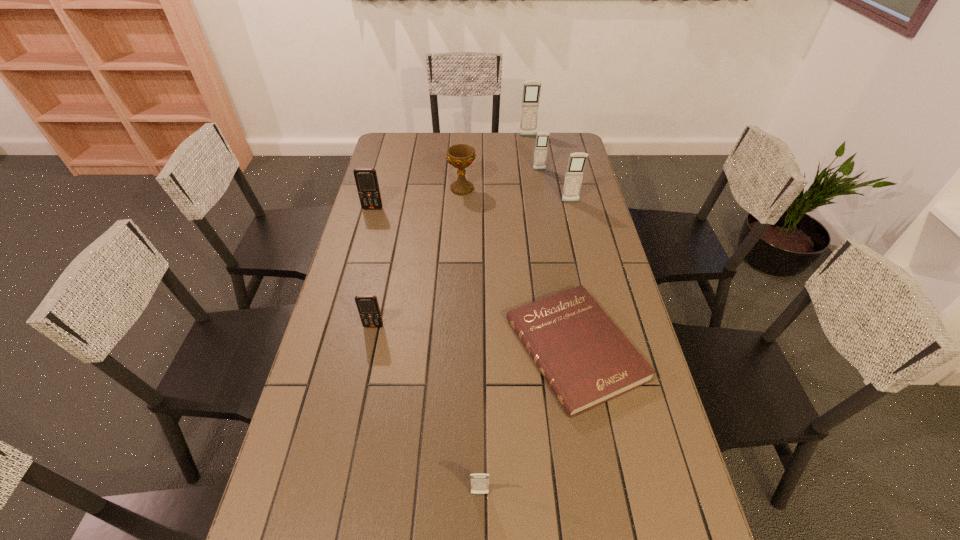
Locate an element on the screen. Image resolution: width=960 pixels, height=540 pixels. unoccupied position between the farthest gray cellular telephone and the nearest gray cellular telephone is located at coordinates tap(504, 315).

At what (x,y) coordinates should I click in order to perform the action: click on free space that is in between the red chalice and the right orange cellular telephone. Please return your answer as a coordinate pair (x, y). Image resolution: width=960 pixels, height=540 pixels. Looking at the image, I should click on (418, 258).

Locate an element on the screen. This screenshot has width=960, height=540. vacant area that lies between the shortest object and the second tallest object is located at coordinates (572, 275).

The width and height of the screenshot is (960, 540). Identify the location of empty space between the tallest cellular telephone and the hardback book. (551, 242).

The height and width of the screenshot is (540, 960). I want to click on vacant region between the red chalice and the second smallest gray cellular telephone, so click(501, 179).

You are a GUI agent. You are given a task and a screenshot of the screen. Output one action in this format:
    pyautogui.click(x=<x>, y=<y>)
    Task: Click on the vacant area that lies between the chalice and the hardback book
    
    Given the screenshot: What is the action you would take?
    pyautogui.click(x=518, y=269)

Identify which object is the fifth closest to the shortest object. Please provide its 2D coordinates. Your answer should be formatted as a tuple, i.e. [(x, y)], where the tuple contains the x and y coordinates of a point satisfying the conditions above.

[(366, 179)]

Locate which object is the sixth closest to the red chalice. Please provide its 2D coordinates. Your answer should be formatted as a tuple, i.e. [(x, y)], where the tuple contains the x and y coordinates of a point satisfying the conditions above.

[(367, 305)]

Point out which cellular telephone is positioned as the third nearest to the farthest cellular telephone. Please provide its 2D coordinates. Your answer should be formatted as a tuple, i.e. [(x, y)], where the tuple contains the x and y coordinates of a point satisfying the conditions above.

[(366, 179)]

Identify which cellular telephone is the fifth closest to the leftmost object. Please provide its 2D coordinates. Your answer should be formatted as a tuple, i.e. [(x, y)], where the tuple contains the x and y coordinates of a point satisfying the conditions above.

[(479, 482)]